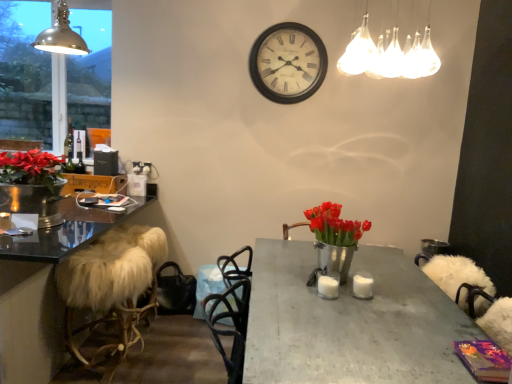
Question: From a real-world perspective, is metallic dome lamp at upper left, placed as the 1th lamp when sorted from back to front, above or below white fur-covered stool at left?

Choices:
 (A) above
 (B) below

Answer: (A)

Question: Is metallic dome lamp at upper left, which is the 1th lamp from left to right, wider or thinner than white fur-covered stool at left?

Choices:
 (A) thin
 (B) wide

Answer: (A)

Question: Which object is positioned farthest from the metallic dome lamp at upper left, the 2th lamp in the right-to-left sequence?

Choices:
 (A) metallic vase with red flowers at center
 (B) metallic gray table at center
 (C) green glass bottle at left
 (D) white fur-covered stool at left
 (E) translucent glass light fixture at upper center, which is counted as the second lamp, starting from the back

Answer: (B)

Question: Which of these objects is positioned farthest from the translucent glass light fixture at upper center, which is counted as the second lamp, starting from the back?

Choices:
 (A) white matte candle at center, which appears as the 1th candle when viewed from the left
 (B) metallic gray table at center
 (C) white fur-covered stool at left
 (D) metallic vase with red flowers at center
 (E) metallic dome lamp at upper left, which is the 2th lamp from front to back

Answer: (E)